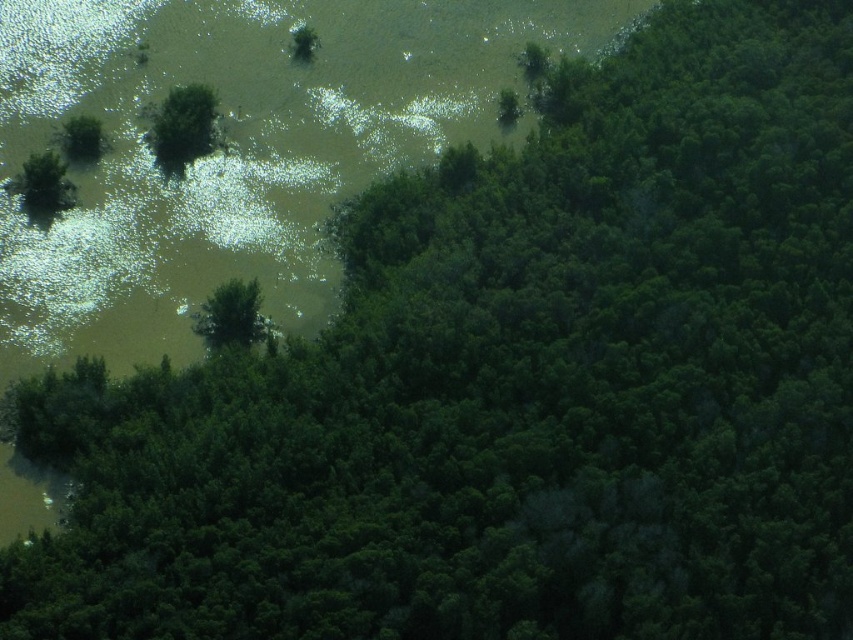
Does green matte tree at upper left appear on the left side of green matte tree at center?

Yes, green matte tree at upper left is to the left of green matte tree at center.

Is point (183, 157) positioned before point (241, 282)?

No, it is not.

Does point (158, 113) come behind point (231, 324)?

Yes, it is.

The height and width of the screenshot is (640, 853). Identify the location of green matte tree at upper left. (183, 125).